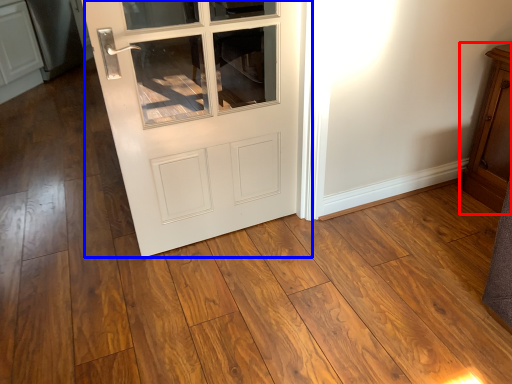
Question: Which object appears farthest to the camera in this image, dresser (highlighted by a red box) or door (highlighted by a blue box)?

Choices:
 (A) dresser
 (B) door

Answer: (A)